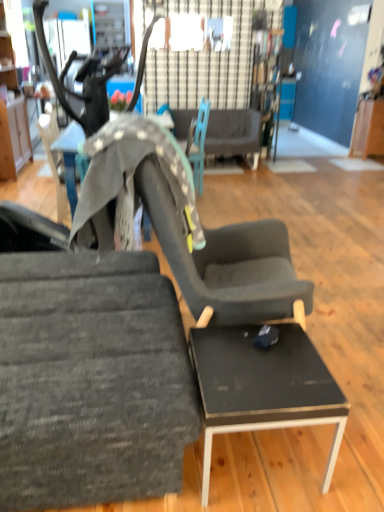
What do you see at coordinates (91, 381) in the screenshot? I see `textured gray fabric chair at left, the 2th chair positioned from the top` at bounding box center [91, 381].

Describe the element at coordinates (198, 142) in the screenshot. Image resolution: width=384 pixels, height=512 pixels. I see `teal fabric chair at center, which appears as the first chair when viewed from the top` at that location.

I want to click on dark gray fabric couch at center, so click(x=234, y=134).

Locate an element on the screen. Image resolution: width=384 pixels, height=512 pixels. black glossy table at lower right is located at coordinates (263, 387).

The image size is (384, 512). I want to click on textured gray fabric chair at left, acting as the second chair starting from the back, so click(x=91, y=381).

From a real-world perspective, who is located higher, teal fabric chair at center, which appears as the first chair when viewed from the top, or wooden cabinet at left?

wooden cabinet at left, from a real-world perspective.

How many degrees apart are the facing directions of teal fabric chair at center, the second chair in the front-to-back sequence, and wooden cabinet at left?

The angle between the facing direction of teal fabric chair at center, the second chair in the front-to-back sequence, and the facing direction of wooden cabinet at left is 179 degrees.

From the image's perspective, which one is positioned lower, teal fabric chair at center, which appears as the first chair when viewed from the top, or wooden cabinet at left?

teal fabric chair at center, which appears as the first chair when viewed from the top, is shown below in the image.

Is black glossy table at lower right located outside wooden cabinet at left?

Indeed, black glossy table at lower right is completely outside wooden cabinet at left.

In the scene shown: Is black glossy table at lower right smaller than wooden cabinet at left?

Correct, black glossy table at lower right occupies less space than wooden cabinet at left.

From a real-world perspective, which is physically below, black glossy table at lower right or wooden cabinet at left?

From a 3D spatial view, black glossy table at lower right is below.

Is black glossy table at lower right surrounded by textured gray fabric chair at left, the 2th chair positioned from the top?

No, black glossy table at lower right is located outside of textured gray fabric chair at left, the 2th chair positioned from the top.

Which of these two, textured gray fabric chair at left, the 1th chair from the bottom, or black glossy table at lower right, is thinner?

Thinner between the two is black glossy table at lower right.

Is textured gray fabric chair at left, acting as the second chair starting from the back, taller than black glossy table at lower right?

Correct, textured gray fabric chair at left, acting as the second chair starting from the back, is much taller as black glossy table at lower right.

Is black glossy table at center situated inside teal fabric chair at center, which appears as the first chair when viewed from the top, or outside?

black glossy table at center is outside teal fabric chair at center, which appears as the first chair when viewed from the top.

Is black glossy table at center placed right next to teal fabric chair at center, which is counted as the 1th chair, starting from the back?

No, black glossy table at center is not with teal fabric chair at center, which is counted as the 1th chair, starting from the back.

Which point is more forward, (68,151) or (196,152)?

Positioned in front is point (68,151).

From a real-world perspective, which object stands above the other?

textured gray fabric chair at left, arranged as the first chair when viewed from the front.

Can you confirm if black glossy table at lower right is taller than textured gray fabric chair at left, the 2th chair positioned from the top?

No.

How far apart are black glossy table at lower right and textured gray fabric chair at left, acting as the second chair starting from the back?

14.11 inches.

Considering the sizes of objects black glossy table at lower right and textured gray fabric chair at left, acting as the second chair starting from the back, in the image provided, who is wider, black glossy table at lower right or textured gray fabric chair at left, acting as the second chair starting from the back,?

textured gray fabric chair at left, acting as the second chair starting from the back.

How many degrees apart are the facing directions of teal fabric chair at center, marked as the second chair in a bottom-to-top arrangement, and black glossy table at center?

The facing directions of teal fabric chair at center, marked as the second chair in a bottom-to-top arrangement, and black glossy table at center are 172 degrees apart.

Which is in front, point (197, 175) or point (77, 127)?

The point (77, 127) is closer.

Does teal fabric chair at center, which appears as the first chair when viewed from the top, lie behind black glossy table at center?

Yes.

Which object is closer to the camera taking this photo, dark gray fabric couch at center or textured gray fabric chair at left, the 1th chair from the bottom?

textured gray fabric chair at left, the 1th chair from the bottom, is in front.

Between dark gray fabric couch at center and textured gray fabric chair at left, acting as the second chair starting from the back, which one appears on the right side from the viewer's perspective?

Positioned to the right is dark gray fabric couch at center.

Locate an element on the screen. The image size is (384, 512). cabinetry above the teal fabric chair at center, which appears as the first chair when viewed from the top (from the image's perspective) is located at coordinates (12, 118).

The height and width of the screenshot is (512, 384). What are the coordinates of `cabinetry lying on the left of black glossy table at lower right` in the screenshot? It's located at (12, 118).

Considering their positions, is black glossy table at center positioned closer to teal fabric chair at center, which appears as the first chair when viewed from the top, than textured gray fabric chair at left, the 2th chair positioned from the top?

black glossy table at center lies closer to teal fabric chair at center, which appears as the first chair when viewed from the top, than the other object.

Which object lies further to the anchor point textured gray fabric chair at left, acting as the second chair starting from the back, dark gray fabric couch at center or teal fabric chair at center, which appears as the first chair when viewed from the top?

The object further to textured gray fabric chair at left, acting as the second chair starting from the back, is dark gray fabric couch at center.

Considering their positions, is wooden cabinet at left positioned further to black glossy table at center than teal fabric chair at center, which is counted as the 1th chair, starting from the back?

wooden cabinet at left.

From the picture: When comparing their distances from wooden cabinet at left, does teal fabric chair at center, which is counted as the 1th chair, starting from the back, or black glossy table at center seem closer?

black glossy table at center.

When comparing their distances from black glossy table at center, does textured gray fabric chair at left, acting as the second chair starting from the back, or black glossy table at lower right seem further?

Based on the image, black glossy table at lower right appears to be further to black glossy table at center.

Which object lies further to the anchor point teal fabric chair at center, which appears as the first chair when viewed from the top, dark gray fabric couch at center or textured gray fabric chair at left, the 2th chair positioned from the top?

textured gray fabric chair at left, the 2th chair positioned from the top, is positioned further to the anchor teal fabric chair at center, which appears as the first chair when viewed from the top.

Estimate the real-world distances between objects in this image. Which object is further from dark gray fabric couch at center, teal fabric chair at center, which appears as the first chair when viewed from the top, or black glossy table at center?

black glossy table at center lies further to dark gray fabric couch at center than the other object.

Looking at the image, which one is located further to textured gray fabric chair at left, the 1th chair from the bottom, teal fabric chair at center, marked as the second chair in a bottom-to-top arrangement, or black glossy table at lower right?

teal fabric chair at center, marked as the second chair in a bottom-to-top arrangement.

This screenshot has height=512, width=384. Find the location of `cabinetry located between black glossy table at center and teal fabric chair at center, the second chair in the front-to-back sequence, in the depth direction`. cabinetry located between black glossy table at center and teal fabric chair at center, the second chair in the front-to-back sequence, in the depth direction is located at coordinates (12, 118).

Image resolution: width=384 pixels, height=512 pixels. In order to click on desk between textured gray fabric chair at left, arranged as the first chair when viewed from the front, and wooden cabinet at left in the front-back direction in this screenshot , I will do `click(263, 387)`.

You are a GUI agent. You are given a task and a screenshot of the screen. Output one action in this format:
    pyautogui.click(x=<x>, y=<y>)
    Task: Click on the cabinetry between textured gray fabric chair at left, the 1th chair from the bottom, and dark gray fabric couch at center in the front-back direction
    
    Given the screenshot: What is the action you would take?
    pyautogui.click(x=12, y=118)

Locate an element on the screen. cabinetry between black glossy table at lower right and teal fabric chair at center, the second chair in the front-to-back sequence, from front to back is located at coordinates click(12, 118).